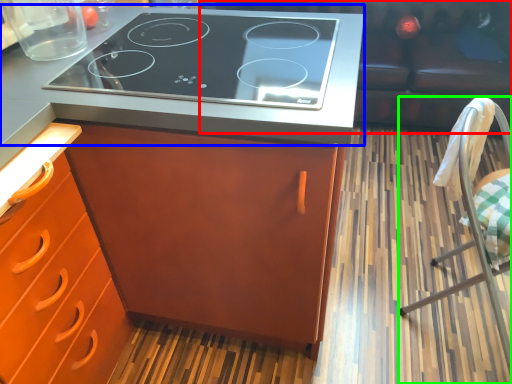
Question: Which object is the closest to the couch (highlighted by a red box)? Choose among these: countertop (highlighted by a blue box) or chair (highlighted by a green box).

Choices:
 (A) countertop
 (B) chair

Answer: (B)